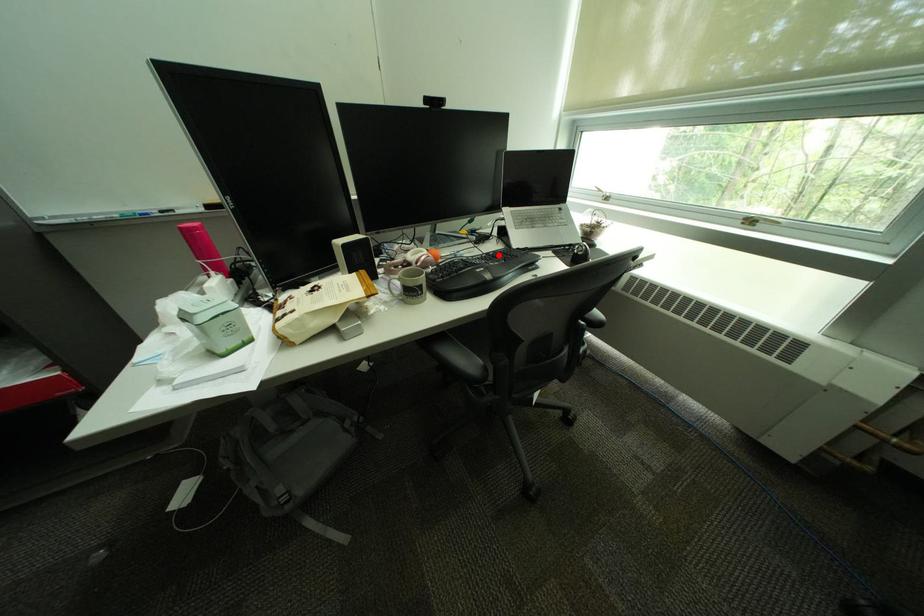
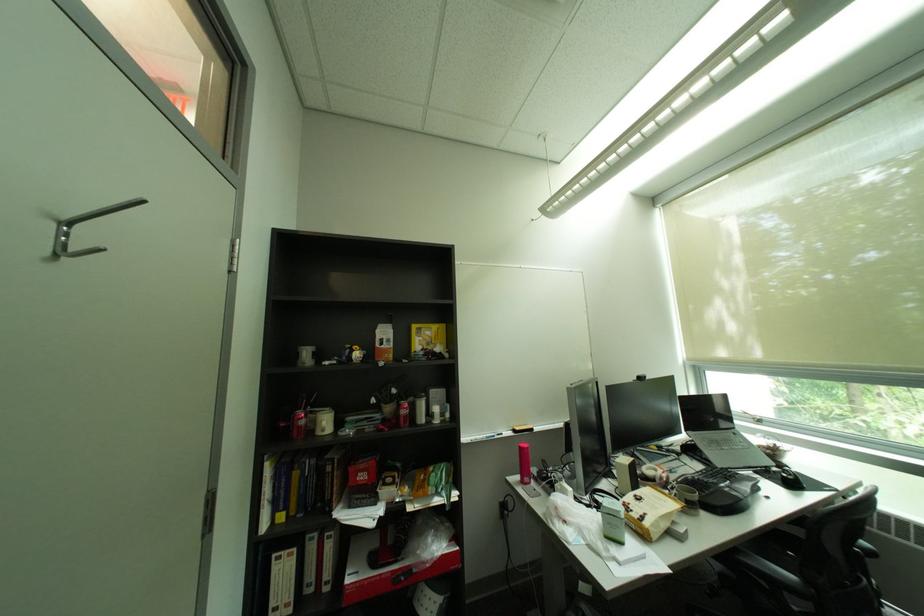
Locate, in the second image, the point that corresponds to the highlighted location in the first image.

(712, 472)